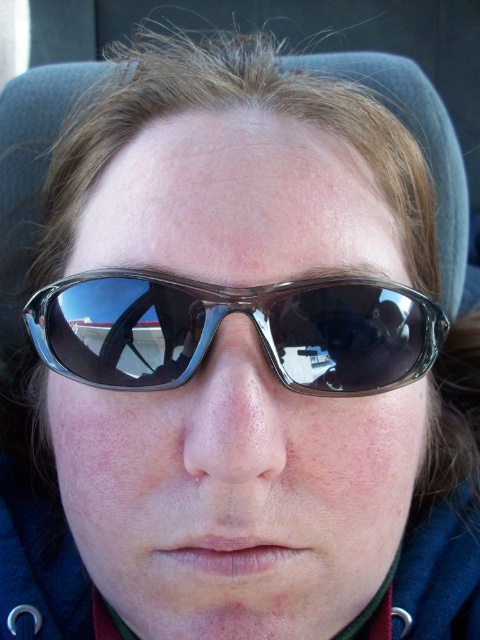
You are designing a mask that needs to cover both the transparent plastic goggles at center and the matte black nose at center. Based on the scene, which object requires the mask to have a larger opening in terms of width?

The transparent plastic goggles at center requires the mask to have a larger opening because its width is larger than the matte black nose at center.

You are a photographer trying to capture a clear shot of the person in the image. Since the transparent plastic goggles at center and the matte black nose at center are both in focus, which object is closer to you?

The transparent plastic goggles at center is closer to you because it is further to the viewer than the matte black nose at center.